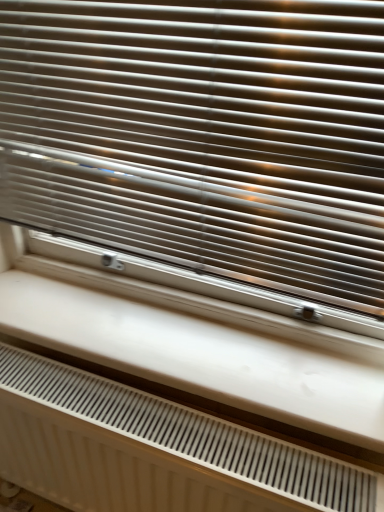
Locate an element on the screen. The height and width of the screenshot is (512, 384). free point above white matte radiator at bottom (from a real-world perspective) is located at coordinates (139, 408).